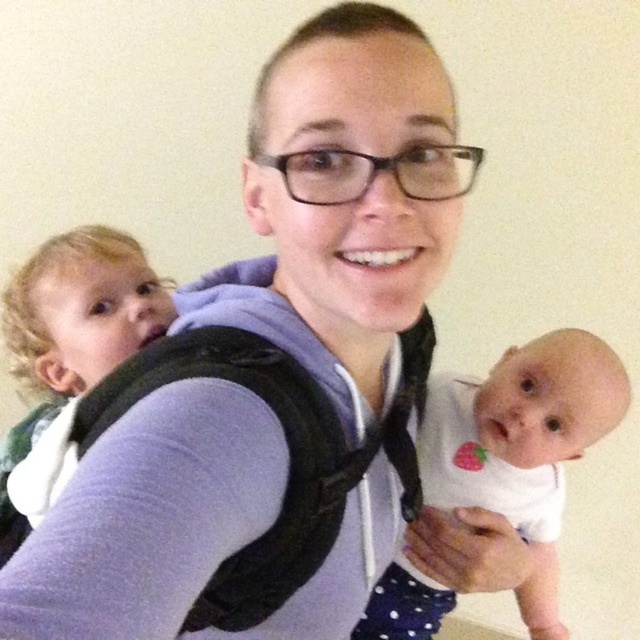
Locate an element on the screen. The width and height of the screenshot is (640, 640). white soft fabric baby at center is located at coordinates (522, 445).

Can you confirm if white soft fabric baby at center is positioned above blonde hair baby carrier at upper left?

Incorrect, white soft fabric baby at center is not positioned above blonde hair baby carrier at upper left.

Locate an element on the screen. The image size is (640, 640). white soft fabric baby at center is located at coordinates (522, 445).

This screenshot has width=640, height=640. In order to click on white soft fabric baby at center in this screenshot , I will do `click(522, 445)`.